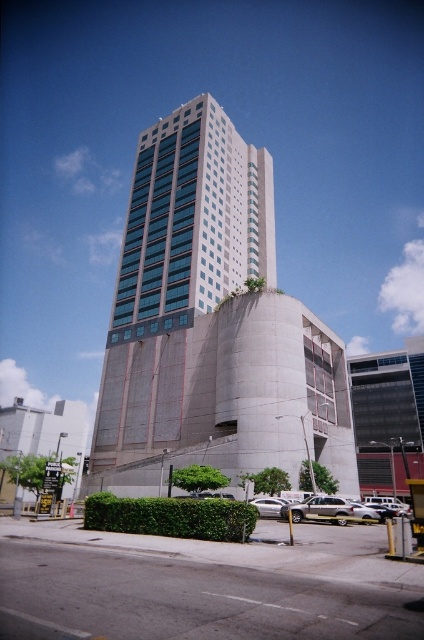
You are standing at point [203,387] and want to walk to the entrance of the building. The entrance is located at the base of the building. Considering the distance between your current position and the entrance, will you need to walk more than 100 feet to reach it?

The distance between point [203,387] and the entrance is 180.18 feet, so yes, you will need to walk more than 100 feet to reach the entrance.

You are a city planner reviewing architectural plans for a new development. You need to ensure that the new construction does not block the view of the concrete building at center from the public square located near the matte concrete building at lower left. Based on the provided image, which building is taller and therefore more likely to obstruct the view?

The concrete building at center is taller than the matte concrete building at lower left, so it is more likely to obstruct the view of the concrete building at center from the public square near the matte concrete building at lower left.